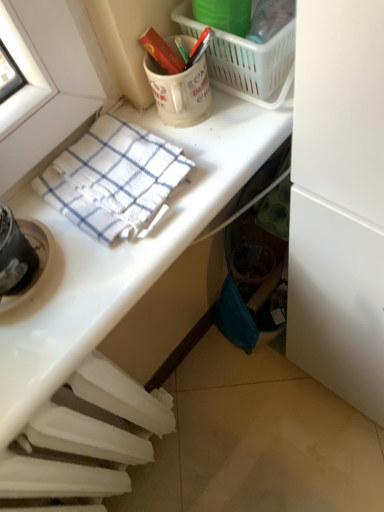
Question: Is white checkered towel at upper left bigger than white matte coffee cup at upper center?

Choices:
 (A) no
 (B) yes

Answer: (B)

Question: Is white checkered towel at upper left outside of white matte coffee cup at upper center?

Choices:
 (A) yes
 (B) no

Answer: (A)

Question: Can you confirm if white checkered towel at upper left is smaller than white matte coffee cup at upper center?

Choices:
 (A) yes
 (B) no

Answer: (B)

Question: Is white checkered towel at upper left not near white matte coffee cup at upper center?

Choices:
 (A) no
 (B) yes

Answer: (A)

Question: Does white checkered towel at upper left lie in front of white matte coffee cup at upper center?

Choices:
 (A) yes
 (B) no

Answer: (A)

Question: Which is correct: white checkered towel at upper left is inside white plastic picnic basket at upper center, or outside of it?

Choices:
 (A) inside
 (B) outside

Answer: (B)

Question: From a real-world perspective, is white checkered towel at upper left above or below white plastic picnic basket at upper center?

Choices:
 (A) below
 (B) above

Answer: (A)

Question: Is white checkered towel at upper left to the left or to the right of white plastic picnic basket at upper center in the image?

Choices:
 (A) left
 (B) right

Answer: (A)

Question: Looking at the image, does white checkered towel at upper left seem bigger or smaller compared to white plastic picnic basket at upper center?

Choices:
 (A) big
 (B) small

Answer: (B)

Question: Is point (228, 55) positioned closer to the camera than point (228, 189)?

Choices:
 (A) closer
 (B) farther

Answer: (B)

Question: Do you think white plastic picnic basket at upper center is within white glossy towel at upper left, or outside of it?

Choices:
 (A) outside
 (B) inside

Answer: (A)

Question: Based on their positions, is white plastic picnic basket at upper center located to the left or right of white glossy towel at upper left?

Choices:
 (A) left
 (B) right

Answer: (B)

Question: From the image's perspective, is white plastic picnic basket at upper center above or below white glossy towel at upper left?

Choices:
 (A) above
 (B) below

Answer: (A)

Question: Relative to white checkered towel at upper left, is white matte coffee cup at upper center in front or behind?

Choices:
 (A) behind
 (B) front

Answer: (A)

Question: In the image, is white matte coffee cup at upper center on the left side or the right side of white checkered towel at upper left?

Choices:
 (A) left
 (B) right

Answer: (B)